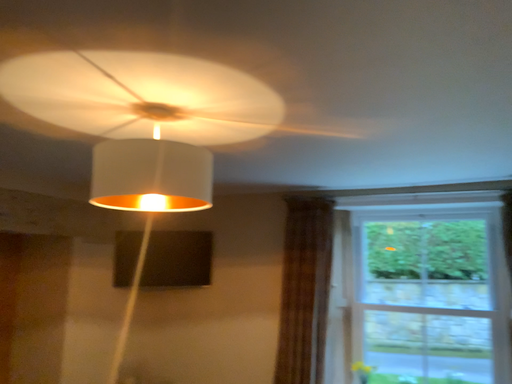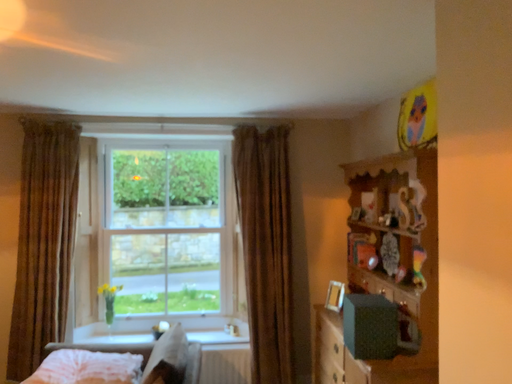
Question: How did the camera likely rotate when shooting the video?

Choices:
 (A) rotated downward
 (B) rotated upward

Answer: (A)